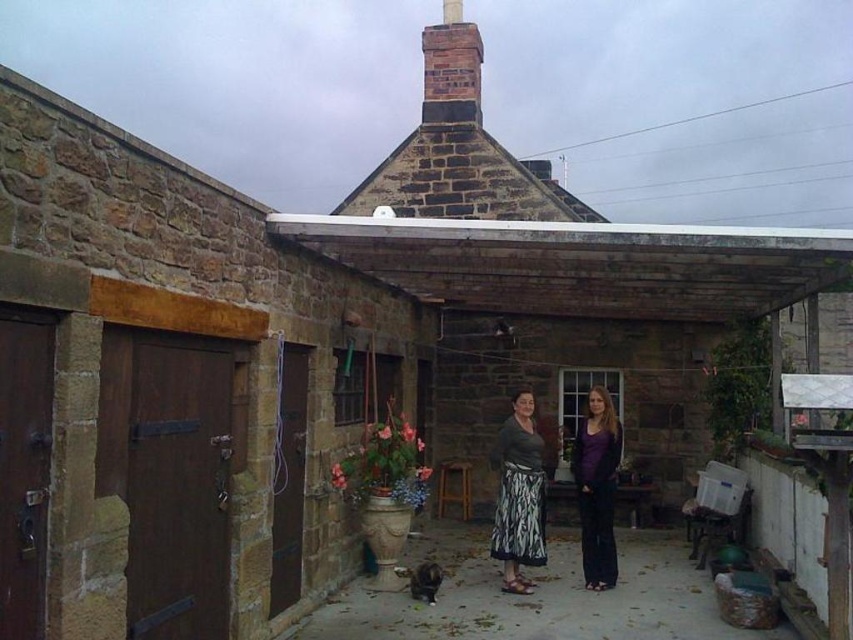
You are standing in the rustic outdoor scene and need to determine which object is smaller between the brown stone alley at center and the matte green skirt at center. Can you identify the smaller one?

The brown stone alley at center is smaller than the matte green skirt at center according to the description.

You are standing at the entrance of the brown stone alley at center and want to pass through while wearing the purple matte pants at center. Considering the alley width, will there be enough space for you to walk through comfortably?

The brown stone alley at center is wider than the purple matte pants at center, so there should be enough space to walk through comfortably.